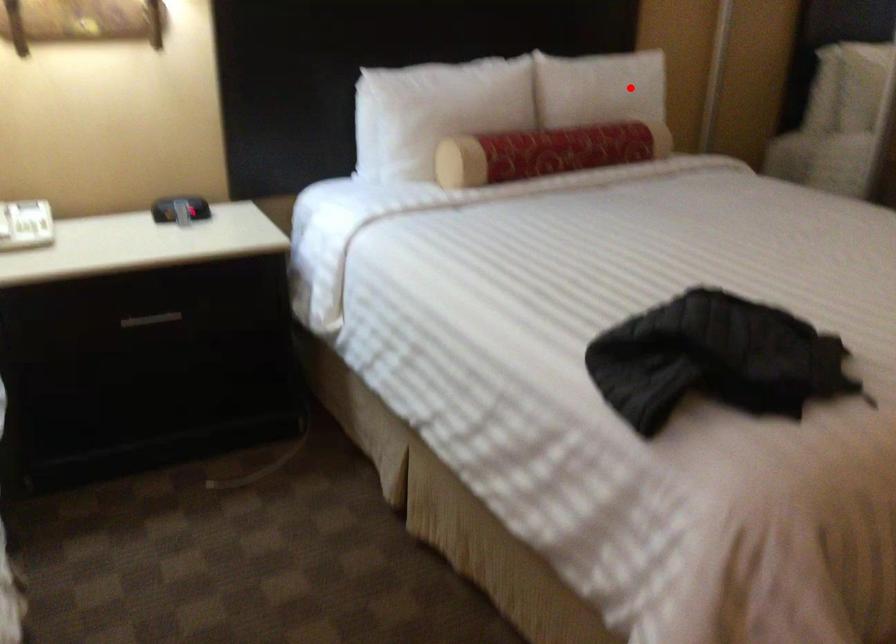
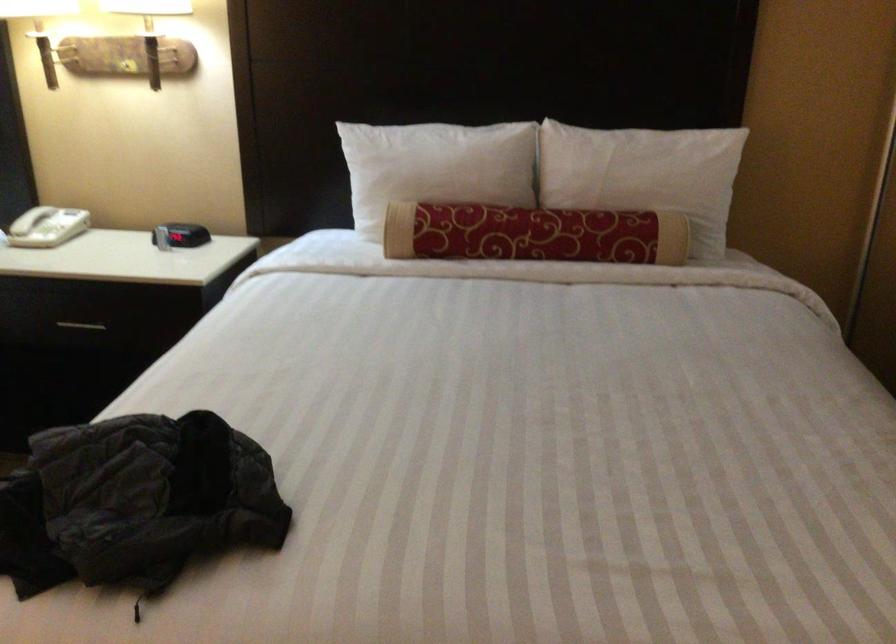
Question: A red point is marked in image1. In image2, is the corresponding 3D point closer to the camera or farther? Reply with the corresponding letter.

Choices:
 (A) The corresponding 3D point is closer.
 (B) The corresponding 3D point is farther.

Answer: (A)